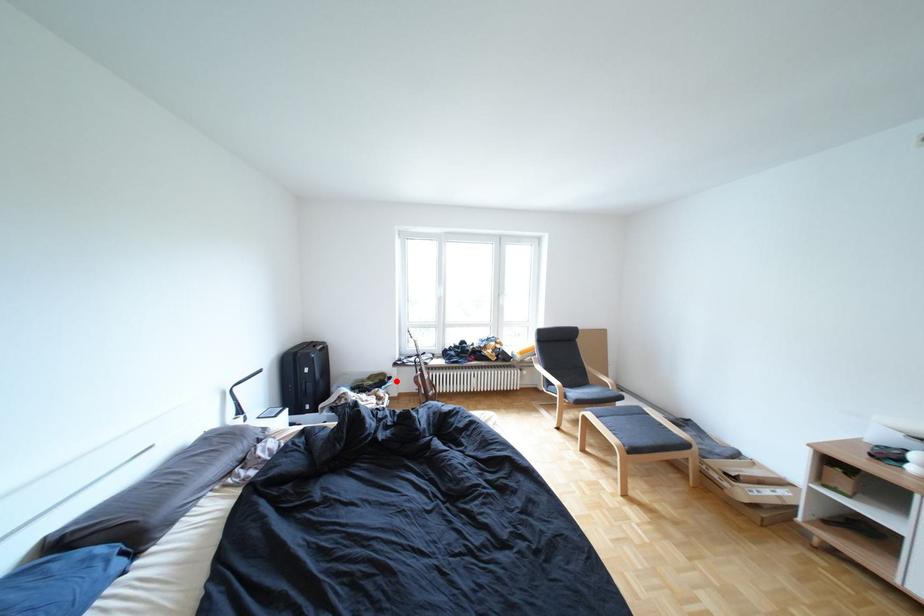
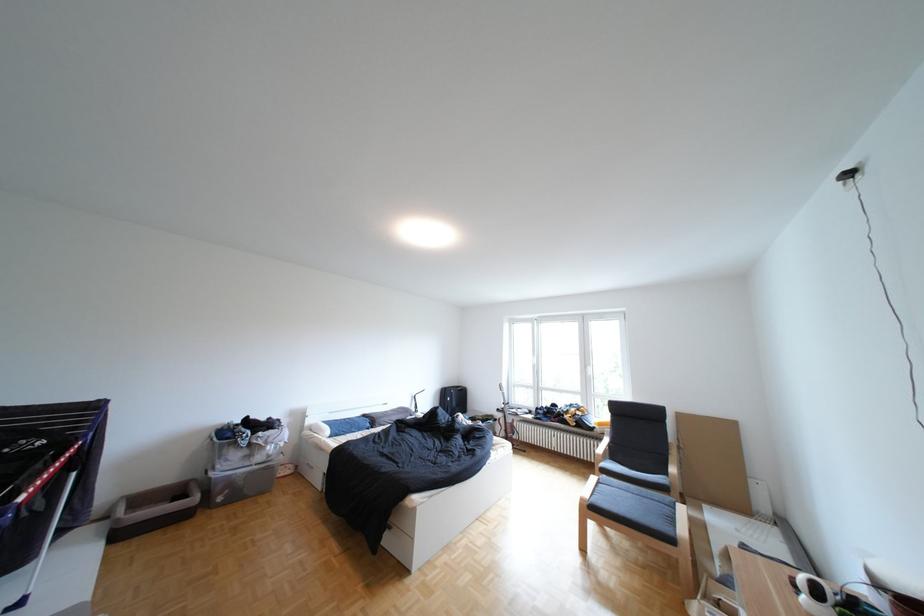
Question: I am providing you with two images of the same scene from different viewpoints. Given a red point in image1, look at the same physical point in image2. Is it:

Choices:
 (A) Closer to the viewpoint
 (B) Farther from the viewpoint

Answer: (B)